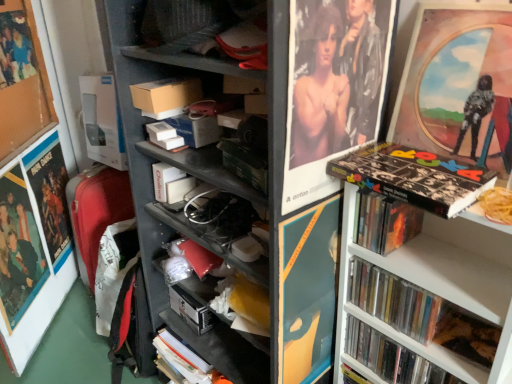
Question: Does matte plastic picture frame at upper right, the 2th picture frame from the left, have a greater width compared to white matte book at center, the fifth book viewed from the right?

Choices:
 (A) no
 (B) yes

Answer: (A)

Question: From the image's perspective, would you say matte plastic picture frame at upper right, the 2th picture frame from the left, is shown under white matte book at center, the fifth book viewed from the right?

Choices:
 (A) yes
 (B) no

Answer: (B)

Question: Is white matte book at center, the fifth book viewed from the right, inside matte plastic picture frame at upper right, the first picture frame positioned from the right?

Choices:
 (A) no
 (B) yes

Answer: (A)

Question: Is matte plastic picture frame at upper right, the first picture frame positioned from the right, positioned in front of white matte book at center, the fifth book viewed from the right?

Choices:
 (A) yes
 (B) no

Answer: (A)

Question: From the image's perspective, would you say matte plastic picture frame at upper right, the 2th picture frame from the left, is positioned over white matte book at center, the fifth book viewed from the right?

Choices:
 (A) no
 (B) yes

Answer: (B)

Question: Is matte plastic picture frame at upper right, the first picture frame positioned from the right, taller than white matte book at center, marked as the 1th book in a left-to-right arrangement?

Choices:
 (A) no
 (B) yes

Answer: (B)

Question: Is matte black poster at left, the second poster page from the right, at the right side of matte cardboard box at center?

Choices:
 (A) no
 (B) yes

Answer: (A)

Question: Could you tell me if matte black poster at left, the second poster page from the right, is facing matte cardboard box at center?

Choices:
 (A) yes
 (B) no

Answer: (A)

Question: Is matte black poster at left, the 2th poster page when ordered from left to right, positioned behind matte cardboard box at center?

Choices:
 (A) yes
 (B) no

Answer: (B)

Question: Is matte black poster at left, the second poster page from the right, positioned far away from matte cardboard box at center?

Choices:
 (A) no
 (B) yes

Answer: (A)

Question: Is matte black poster at left, the 2th poster page when ordered from left to right, shorter than matte cardboard box at center?

Choices:
 (A) yes
 (B) no

Answer: (B)

Question: Is matte black poster at left, the second poster page from the right, positioned beyond the bounds of matte cardboard box at center?

Choices:
 (A) no
 (B) yes

Answer: (B)

Question: Is black matte book at upper right, arranged as the 3th book when viewed from the right, positioned behind metallic silver cd case at right, positioned as the 2th book in right-to-left order?

Choices:
 (A) no
 (B) yes

Answer: (A)